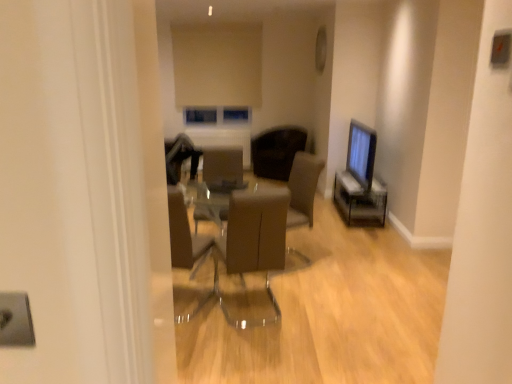
Question: From their relative heights in the image, would you say matte black monitor at right is taller or shorter than matte brown armchair at center?

Choices:
 (A) tall
 (B) short

Answer: (B)

Question: Looking at their shapes, would you say matte black monitor at right is wider or thinner than matte brown armchair at center?

Choices:
 (A) wide
 (B) thin

Answer: (B)

Question: Considering the real-world distances, which object is closest to the brown leather chair at center, the 1th chair positioned from the bottom?

Choices:
 (A) brown leather chair at center, arranged as the second chair when viewed from the front
 (B) matte black monitor at right
 (C) matte brown armchair at center

Answer: (C)

Question: Which is farther from the matte black monitor at right?

Choices:
 (A) matte brown armchair at center
 (B) brown leather chair at center, acting as the 1th chair starting from the front
 (C) brown leather chair at center, which ranks as the 1th chair in top-to-bottom order

Answer: (B)